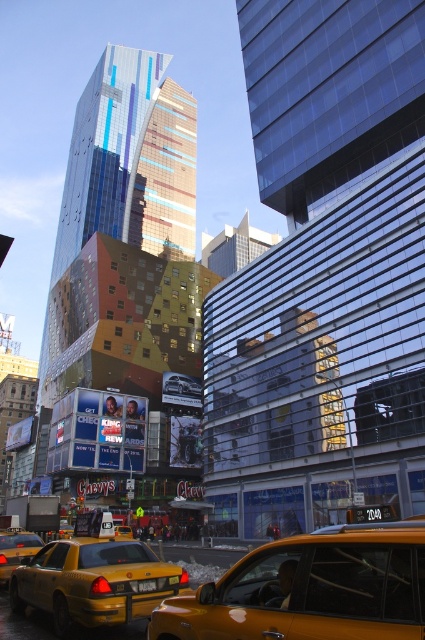
Who is positioned more to the left, yellow rubber taxi cab at lower left or yellow matte taxi cab at lower left?

Positioned to the left is yellow rubber taxi cab at lower left.

Describe the element at coordinates (16, 550) in the screenshot. I see `yellow rubber taxi cab at lower left` at that location.

Which is in front, point (42, 544) or point (121, 536)?

Positioned in front is point (121, 536).

Locate an element on the screen. Image resolution: width=425 pixels, height=640 pixels. yellow rubber taxi cab at lower left is located at coordinates (16, 550).

Which is in front, point (285, 609) or point (190, 381)?

Point (285, 609)

Which is below, yellow glossy taxi at center or metallic silver car at center?

Positioned lower is metallic silver car at center.

Who is more forward, [305,580] or [184,378]?

Point [305,580] is in front.

Locate an element on the screen. Image resolution: width=425 pixels, height=640 pixels. yellow glossy taxi at center is located at coordinates (311, 589).

Measure the distance between point (2,547) and camera.

A distance of 86.99 feet exists between point (2,547) and camera.

Who is taller, yellow rubber taxi cab at lower left or metallic silver car at center?

metallic silver car at center

Measure the distance between point (16, 561) and camera.

Point (16, 561) and camera are 25.93 meters apart from each other.

The image size is (425, 640). What are the coordinates of `yellow rubber taxi cab at lower left` in the screenshot? It's located at (16, 550).